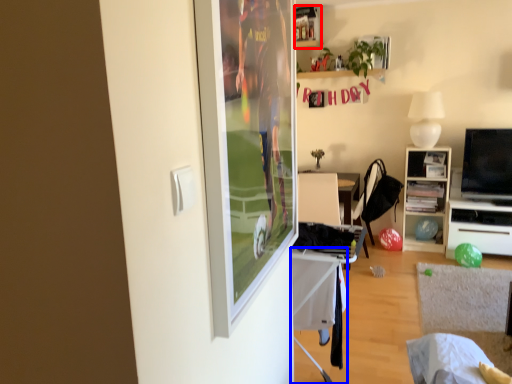
Question: Which object appears farthest to the camera in this image, shelf (highlighted by a red box) or table (highlighted by a blue box)?

Choices:
 (A) shelf
 (B) table

Answer: (A)